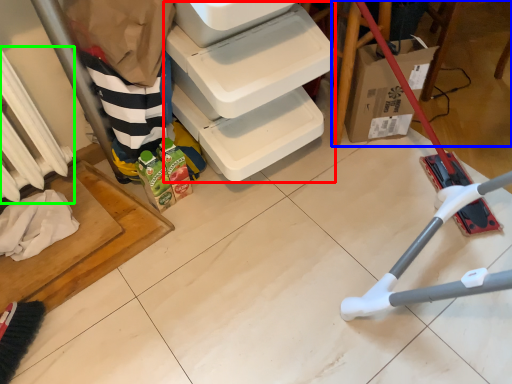
Question: Which object is the farthest from shelf (highlighted by a red box)? Choose among these: furniture (highlighted by a blue box) or radiator (highlighted by a green box).

Choices:
 (A) furniture
 (B) radiator

Answer: (B)